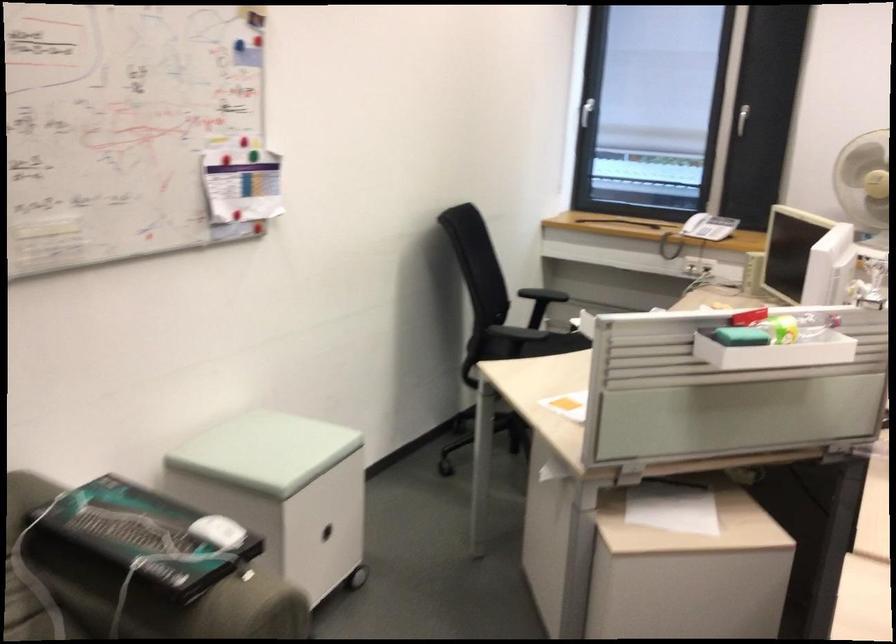
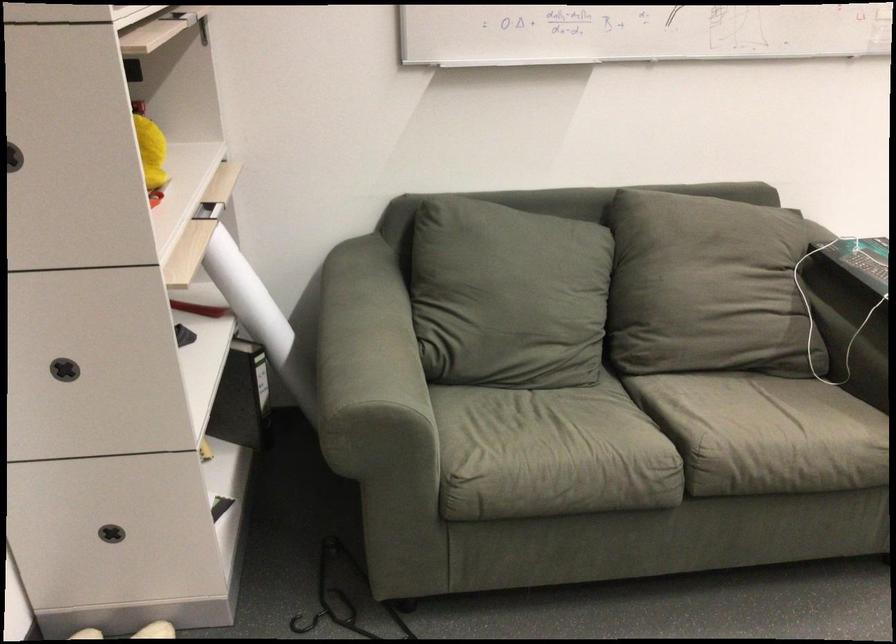
Find the pixel in the second image that matches (88,506) in the first image.

(860, 259)